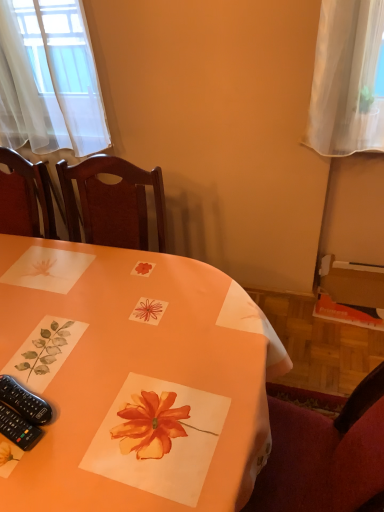
I want to click on free spot above orange paper placemat at center (from a real-world perspective), so click(122, 337).